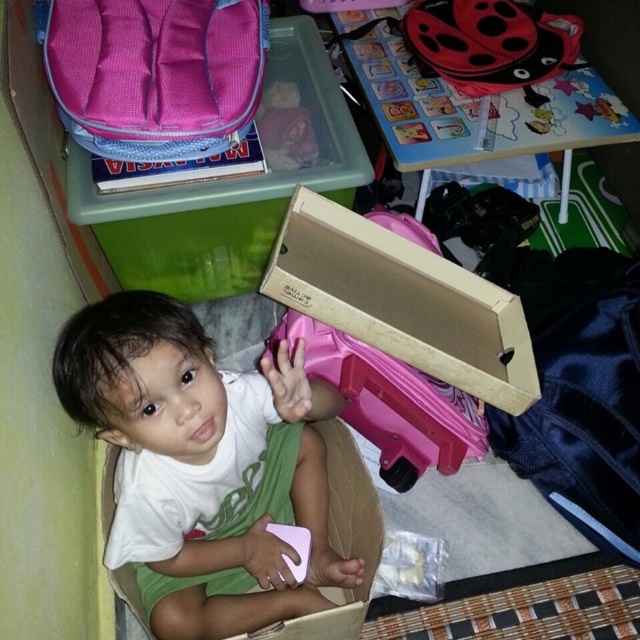
Based on the photo, is white matte toddler at center to the right of pink plastic suitcase at center from the viewer's perspective?

Incorrect, white matte toddler at center is not on the right side of pink plastic suitcase at center.

Between white matte toddler at center and pink plastic suitcase at center, which one is positioned lower?

white matte toddler at center is below.

Image resolution: width=640 pixels, height=640 pixels. What are the coordinates of `white matte toddler at center` in the screenshot? It's located at (202, 465).